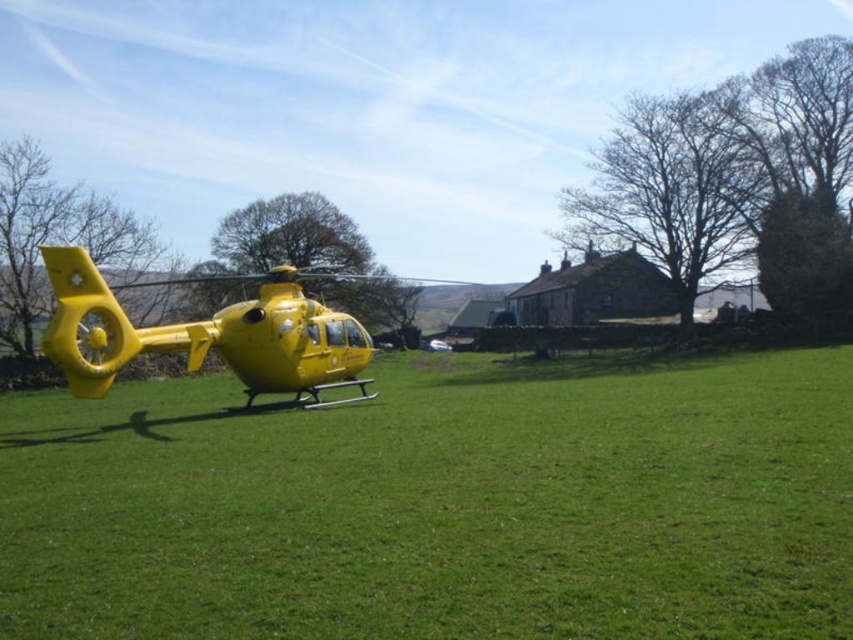
Question: Which object is farther from the camera taking this photo?

Choices:
 (A) yellow matte helicopter at center
 (B) yellow matte helicopter at left

Answer: (A)

Question: Which of the following is the closest to the observer?

Choices:
 (A) yellow matte helicopter at left
 (B) yellow matte helicopter at center

Answer: (A)

Question: Can you confirm if yellow matte helicopter at left is positioned above yellow matte helicopter at center?

Choices:
 (A) yes
 (B) no

Answer: (B)

Question: Is yellow matte helicopter at left positioned in front of yellow matte helicopter at center?

Choices:
 (A) yes
 (B) no

Answer: (A)

Question: Does yellow matte helicopter at left have a smaller size compared to yellow matte helicopter at center?

Choices:
 (A) no
 (B) yes

Answer: (B)